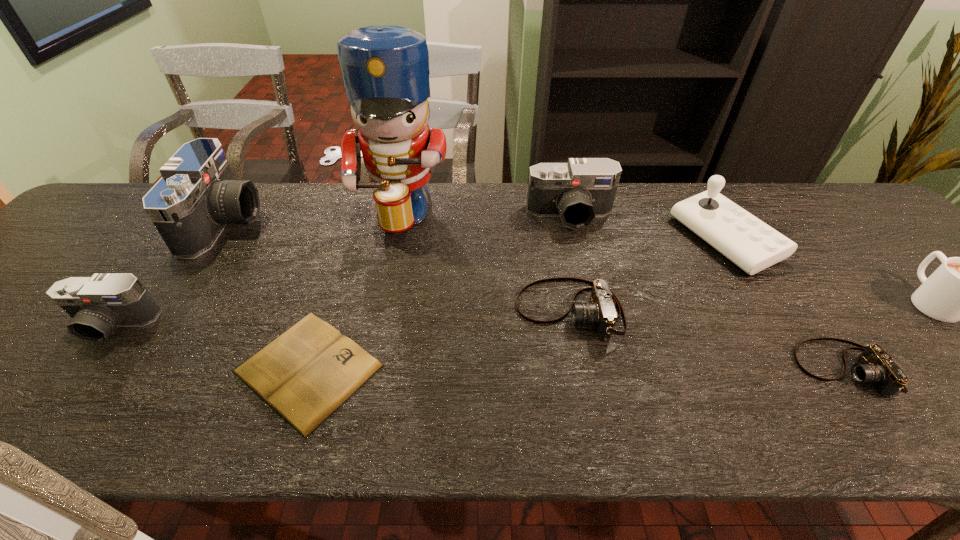
In order to click on the tallest object in this screenshot , I will do `click(385, 68)`.

Find the location of `blue nutcracker`. blue nutcracker is located at coordinates (385, 68).

Find the location of a particular element. the biggest black camera is located at coordinates (198, 195).

Locate an element on the screen. the tallest camera is located at coordinates (198, 195).

You are a GUI agent. You are given a task and a screenshot of the screen. Output one action in this format:
    pyautogui.click(x=<x>, y=<y>)
    Task: Click on the joystick
    Image resolution: width=960 pixels, height=540 pixels.
    Given the screenshot: What is the action you would take?
    pyautogui.click(x=752, y=245)

Where is `the second smallest black camera`? the second smallest black camera is located at coordinates (578, 191).

Find the location of `the second tallest camera`. the second tallest camera is located at coordinates (578, 191).

The height and width of the screenshot is (540, 960). Identify the location of the nearest black camera. (x=97, y=304).

Find the location of `the smallest black camera`. the smallest black camera is located at coordinates (97, 304).

At what (x,y) coordinates should I click in order to perform the action: click on the second shortest camera. Please return your answer as a coordinate pair (x, y). The image size is (960, 540). Looking at the image, I should click on (600, 311).